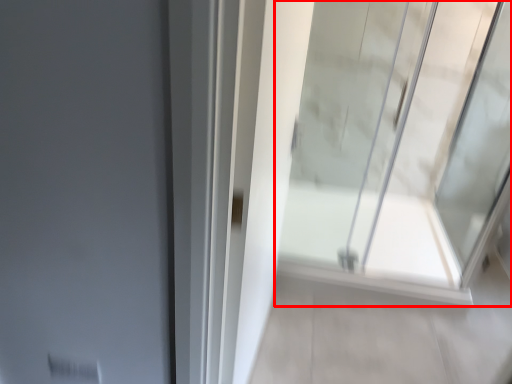
Question: Observing the image, what is the correct spatial positioning of window (annotated by the red box) in reference to path?

Choices:
 (A) right
 (B) left

Answer: (B)